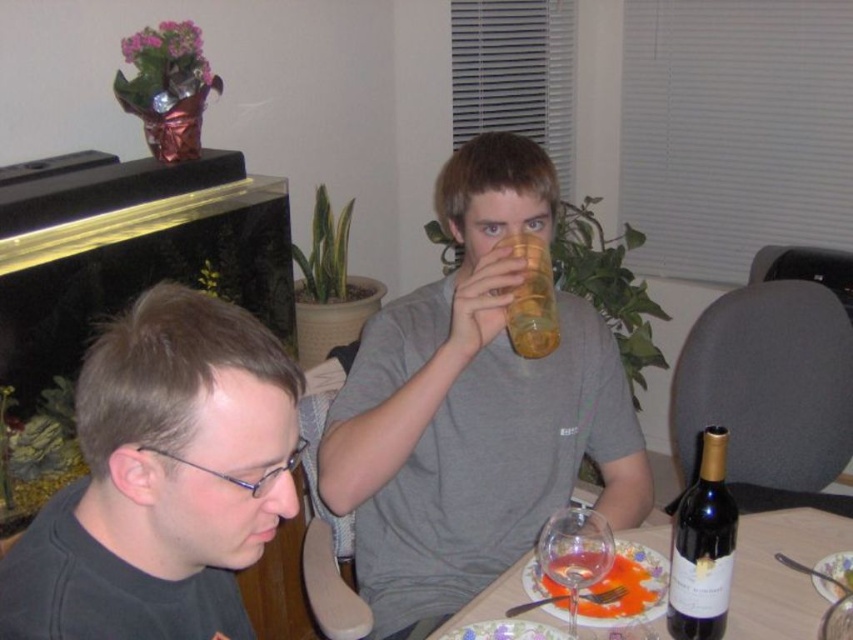
Describe the element at coordinates (781, 572) in the screenshot. I see `translucent glass wine glass at lower center` at that location.

Is point (747, 614) less distant than point (717, 515)?

That is False.

You are a GUI agent. You are given a task and a screenshot of the screen. Output one action in this format:
    pyautogui.click(x=<x>, y=<y>)
    Task: Click on the translucent glass wine glass at lower center
    
    Given the screenshot: What is the action you would take?
    (781, 572)

Is dark glass wine bottle at lower right above translucent glass wine at lower center?

Correct, dark glass wine bottle at lower right is located above translucent glass wine at lower center.

Is dark glass wine bottle at lower right below translucent glass wine at lower center?

Actually, dark glass wine bottle at lower right is above translucent glass wine at lower center.

You are a GUI agent. You are given a task and a screenshot of the screen. Output one action in this format:
    pyautogui.click(x=<x>, y=<y>)
    Task: Click on the dark glass wine bottle at lower right
    The width and height of the screenshot is (853, 640).
    Given the screenshot: What is the action you would take?
    coord(701,547)

Which of these two, dark glass wine bottle at lower right or translucent plastic cup at upper center, stands shorter?

translucent plastic cup at upper center is shorter.

Is dark glass wine bottle at lower right shorter than translucent plastic cup at upper center?

No.

Identify the location of dark glass wine bottle at lower right. (701, 547).